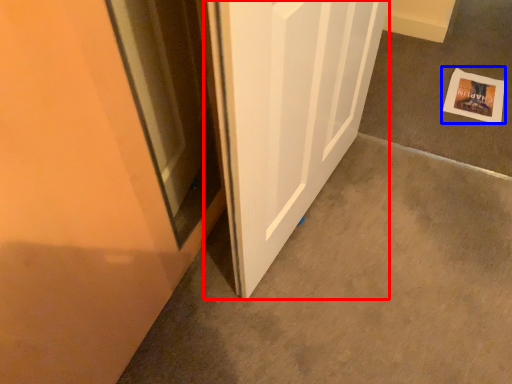
Question: Among these objects, which one is nearest to the camera, door (highlighted by a red box) or postcard (highlighted by a blue box)?

Choices:
 (A) door
 (B) postcard

Answer: (A)